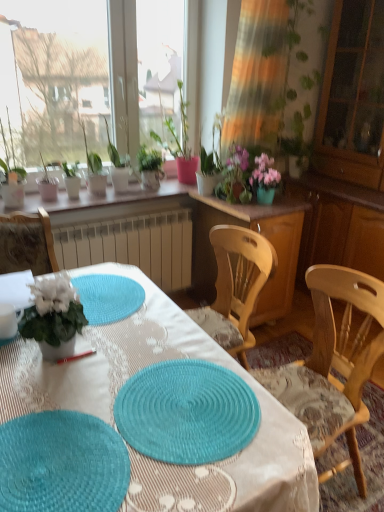
Where is `vacant space that's between teal woven mat at lower left, which is the 1th mat in left-to-right order, and white matte plant at left, the 5th houseplant from the left`? vacant space that's between teal woven mat at lower left, which is the 1th mat in left-to-right order, and white matte plant at left, the 5th houseplant from the left is located at coordinates [59, 389].